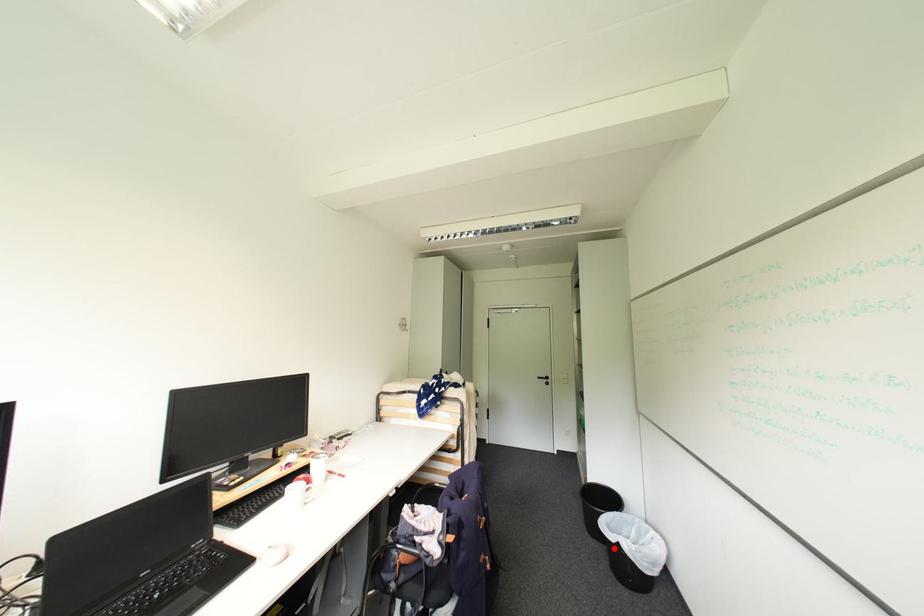
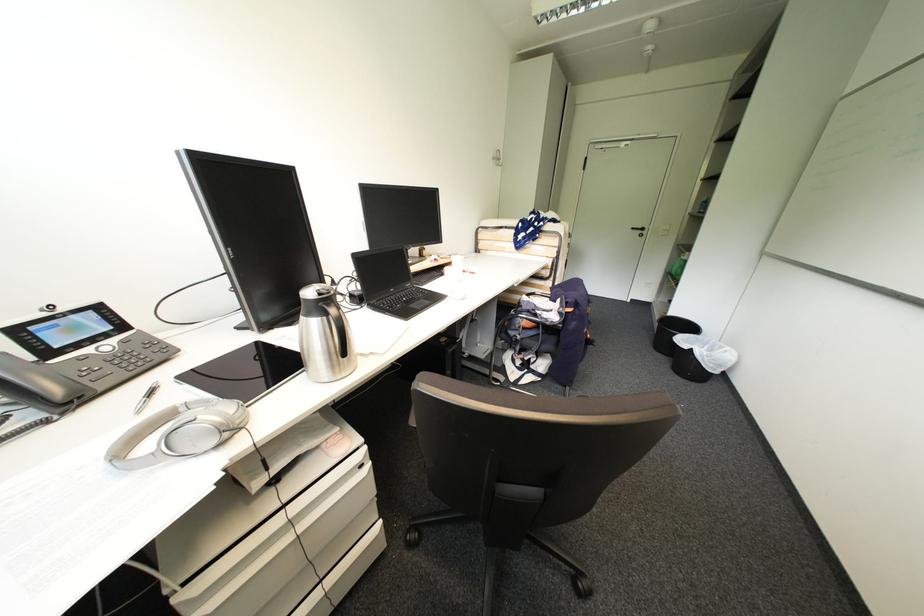
Where in the second image is the point corresponding to the highlighted location from the first image?

(677, 359)